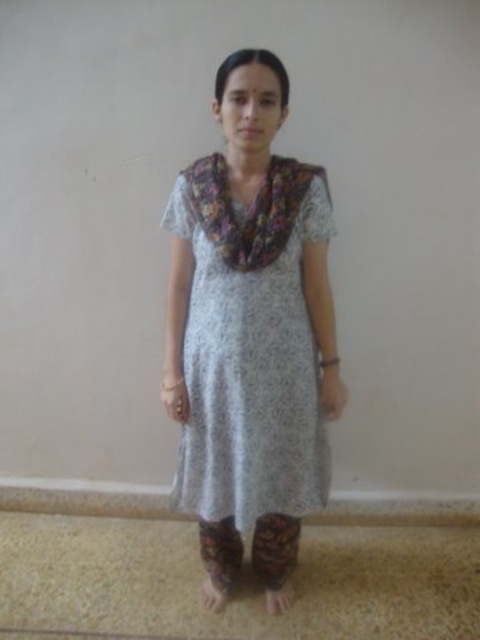
Which is in front, point (180, 486) or point (190, 200)?

Point (190, 200) is more forward.

Does white printed dress at center appear over floral fabric scarf at center?

Actually, white printed dress at center is below floral fabric scarf at center.

Which is in front, point (236, 508) or point (244, 252)?

Point (244, 252)

I want to click on white printed dress at center, so click(x=250, y=346).